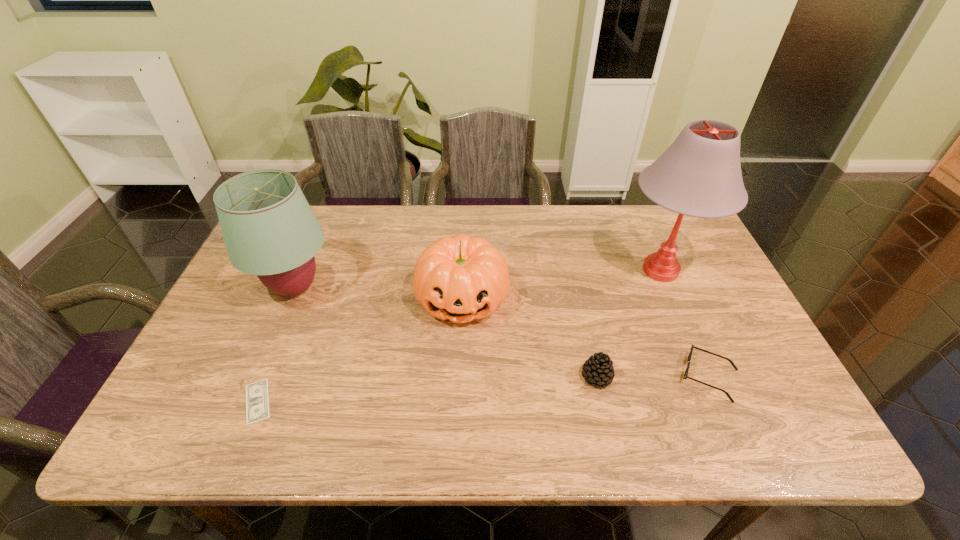
In the image, there is a desktop. Identify the location of vacant space at the left edge. The image size is (960, 540). (222, 323).

The height and width of the screenshot is (540, 960). Identify the location of empty space that is in between the tallest object and the sunglasses. (684, 323).

The image size is (960, 540). Identify the location of empty location between the second shortest object and the second tallest object. (502, 333).

Locate an element on the screen. unoccupied position between the third tallest object and the sunglasses is located at coordinates (586, 337).

Locate an element on the screen. This screenshot has height=540, width=960. unoccupied area between the fifth tallest object and the table lamp is located at coordinates (684, 323).

In order to click on free area in between the fifth tallest object and the third object from right to left in this screenshot , I will do `click(653, 376)`.

This screenshot has width=960, height=540. I want to click on vacant region between the money and the fourth object from left to right, so click(x=427, y=389).

At what (x,y) coordinates should I click in order to perform the action: click on free point between the table lamp and the third object from left to right. Please return your answer as a coordinate pair (x, y). The height and width of the screenshot is (540, 960). Looking at the image, I should click on (562, 284).

The width and height of the screenshot is (960, 540). In order to click on free spot between the sunglasses and the shortest object in this screenshot , I will do `click(483, 389)`.

You are a GUI agent. You are given a task and a screenshot of the screen. Output one action in this format:
    pyautogui.click(x=<x>, y=<y>)
    Task: Click on the vacant space that's between the fifth tallest object and the lampshade
    
    Given the screenshot: What is the action you would take?
    [x=502, y=333]